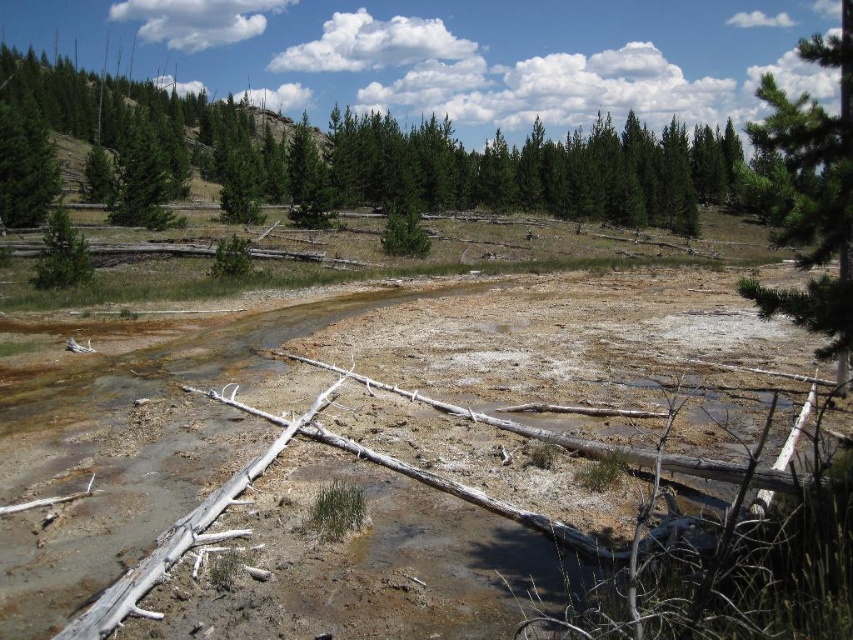
Is point (432, 193) positioned in front of point (772, 124)?

No.

Based on the photo, between green matte tree at upper center and green textured pine tree at upper right, which one has more height?

green matte tree at upper center

Which is in front, point (123, 145) or point (844, 1)?

Point (844, 1) is in front.

Where is `green matte tree at upper center`? green matte tree at upper center is located at coordinates (380, 156).

Is brown clayey mud at center further to camera compared to green matte tree at left?

No, brown clayey mud at center is closer to the viewer.

Between brown clayey mud at center and green matte tree at left, which one appears on the right side from the viewer's perspective?

From the viewer's perspective, brown clayey mud at center appears more on the right side.

Describe the element at coordinates (376, 456) in the screenshot. I see `brown clayey mud at center` at that location.

This screenshot has width=853, height=640. What are the coordinates of `brown clayey mud at center` in the screenshot? It's located at (376, 456).

Which is more to the left, brown clayey mud at center or green matte tree at upper center?

green matte tree at upper center is more to the left.

Is point (463, 538) positioned in front of point (572, 152)?

Yes, it is.

Does point (376, 340) come behind point (712, 138)?

No.

You are a GUI agent. You are given a task and a screenshot of the screen. Output one action in this format:
    pyautogui.click(x=<x>, y=<y>)
    Task: Click on the brown clayey mud at center
    
    Given the screenshot: What is the action you would take?
    pyautogui.click(x=376, y=456)